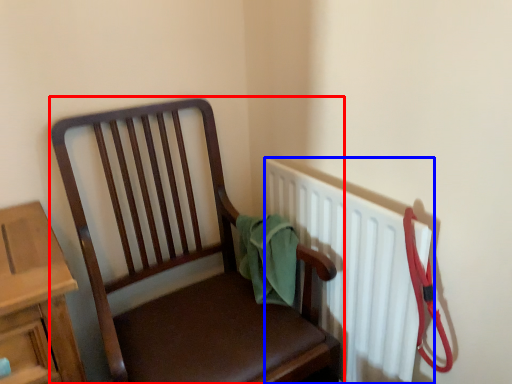
Question: Among these objects, which one is nearest to the camera, chair (highlighted by a red box) or radiator (highlighted by a blue box)?

Choices:
 (A) chair
 (B) radiator

Answer: (A)